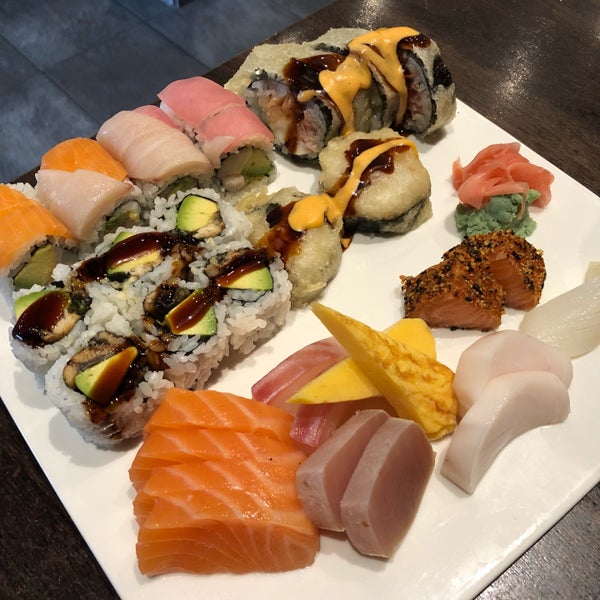
The width and height of the screenshot is (600, 600). What are the coordinates of `tile` in the screenshot? It's located at (48, 120), (127, 61), (63, 16), (10, 65), (210, 20), (147, 10), (311, 7).